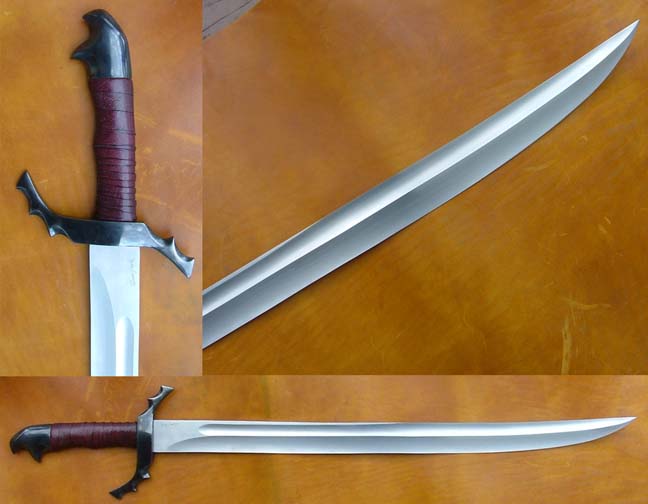
Locate an element on the screen. handle is located at coordinates (78, 434).